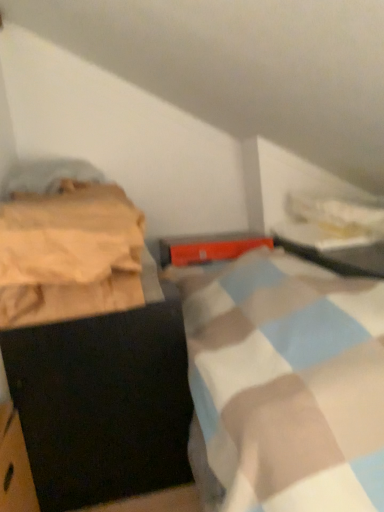
Question: Does beige cotton blanket at left lie in front of metallic silver table at upper right?

Choices:
 (A) no
 (B) yes

Answer: (B)

Question: Considering the relative sizes of beige cotton blanket at left and metallic silver table at upper right in the image provided, is beige cotton blanket at left smaller than metallic silver table at upper right?

Choices:
 (A) no
 (B) yes

Answer: (B)

Question: Are beige cotton blanket at left and metallic silver table at upper right far apart?

Choices:
 (A) no
 (B) yes

Answer: (A)

Question: Does beige cotton blanket at left have a lesser width compared to metallic silver table at upper right?

Choices:
 (A) yes
 (B) no

Answer: (B)

Question: From the image's perspective, would you say beige cotton blanket at left is positioned over metallic silver table at upper right?

Choices:
 (A) no
 (B) yes

Answer: (A)

Question: In terms of size, does beige cotton blanket at left appear bigger or smaller than black matte cabinet at left?

Choices:
 (A) big
 (B) small

Answer: (B)

Question: Based on their positions, is beige cotton blanket at left located to the left or right of black matte cabinet at left?

Choices:
 (A) left
 (B) right

Answer: (A)

Question: Which is correct: beige cotton blanket at left is inside black matte cabinet at left, or outside of it?

Choices:
 (A) inside
 (B) outside

Answer: (B)

Question: From their relative heights in the image, would you say beige cotton blanket at left is taller or shorter than black matte cabinet at left?

Choices:
 (A) tall
 (B) short

Answer: (B)

Question: Based on their positions, is beige cotton blanket at left located to the left or right of metallic silver table at upper right?

Choices:
 (A) right
 (B) left

Answer: (B)

Question: Looking at their shapes, would you say beige cotton blanket at left is wider or thinner than metallic silver table at upper right?

Choices:
 (A) thin
 (B) wide

Answer: (B)

Question: Relative to metallic silver table at upper right, is beige cotton blanket at left in front or behind?

Choices:
 (A) behind
 (B) front

Answer: (B)

Question: Is beige cotton blanket at left bigger or smaller than metallic silver table at upper right?

Choices:
 (A) small
 (B) big

Answer: (A)

Question: Does point tap(342, 267) appear closer or farther from the camera than point tap(109, 238)?

Choices:
 (A) closer
 (B) farther

Answer: (B)

Question: Looking at their shapes, would you say metallic silver table at upper right is wider or thinner than beige cotton blanket at left?

Choices:
 (A) wide
 (B) thin

Answer: (B)